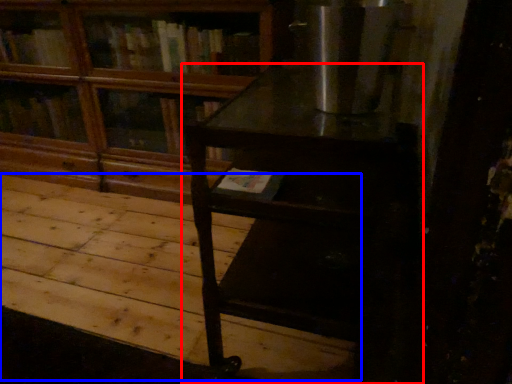
Question: Among these objects, which one is farthest to the camera, table (highlighted by a red box) or plywood (highlighted by a blue box)?

Choices:
 (A) table
 (B) plywood

Answer: (B)